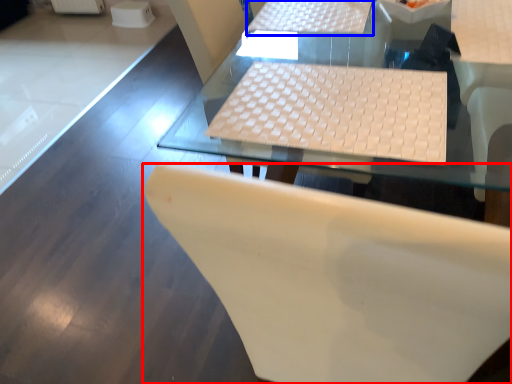
Question: Among these objects, which one is farthest to the camera, chair (highlighted by a red box) or table (highlighted by a blue box)?

Choices:
 (A) chair
 (B) table

Answer: (B)